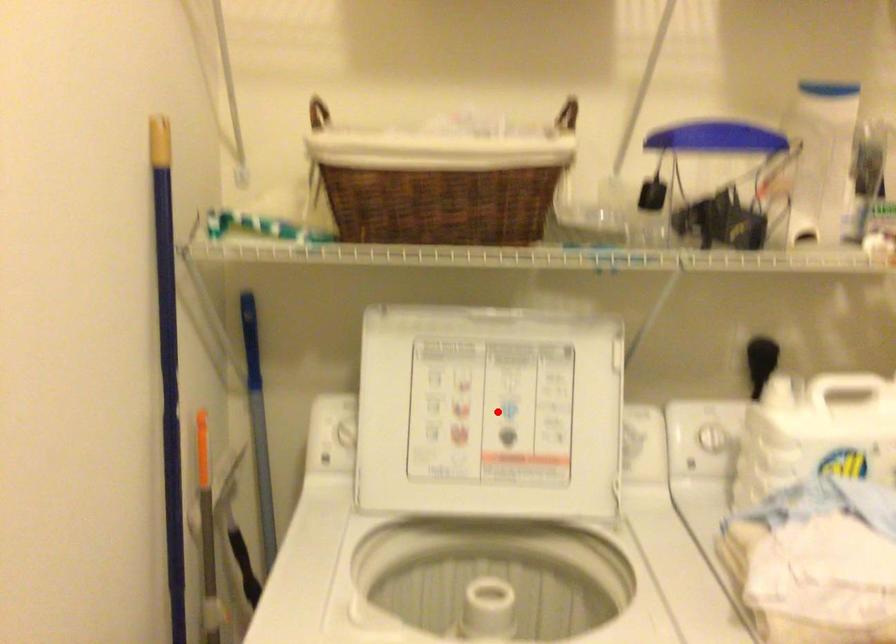
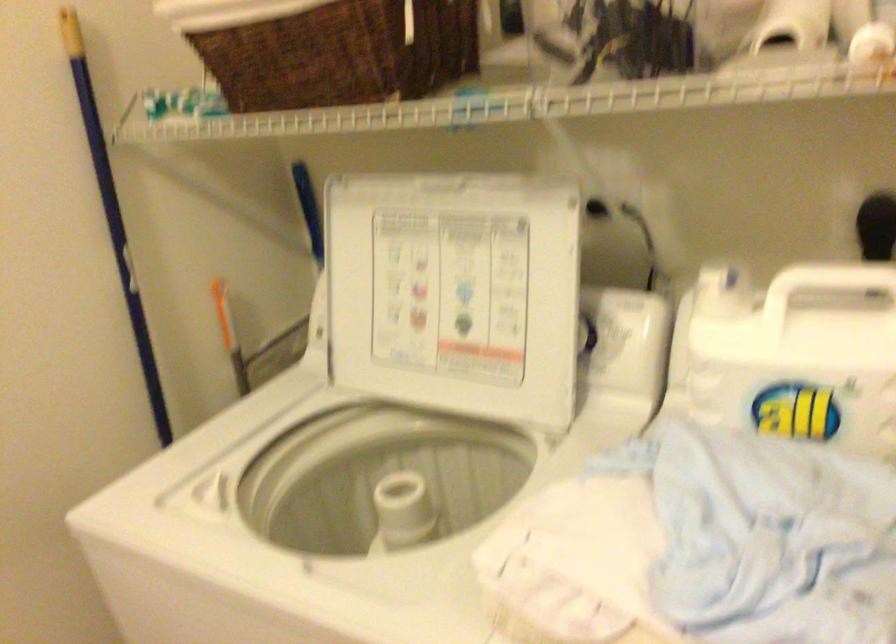
Find the pixel in the second image that matches the highlighted location in the first image.

(454, 292)